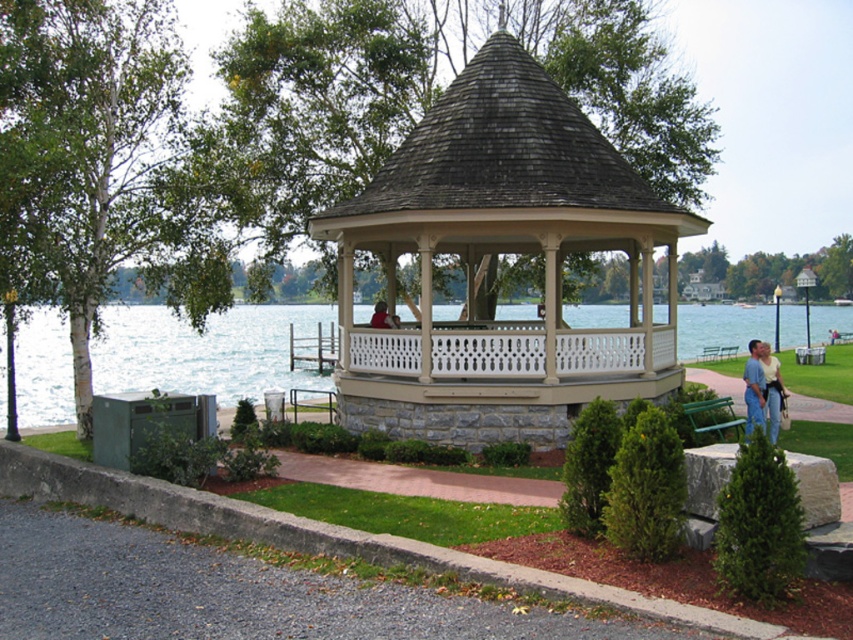
Question: Which is farther from the green wooden bench at center?

Choices:
 (A) red shirt at center
 (B) light blue jeans at lower right
 (C) clear blue water at lower left

Answer: (B)

Question: Based on their relative distances, which object is farther from the clear blue water at lower left?

Choices:
 (A) light blue jeans at lower right
 (B) beige wood gazebo at center

Answer: (A)

Question: Which point appears closest to the camera in this image?

Choices:
 (A) (756, 371)
 (B) (560, 397)

Answer: (A)

Question: Can you confirm if light blue jeans at lower right is positioned to the right of red shirt at center?

Choices:
 (A) yes
 (B) no

Answer: (A)

Question: Is beige wood gazebo at center to the right of red shirt at center from the viewer's perspective?

Choices:
 (A) yes
 (B) no

Answer: (A)

Question: Can you confirm if clear blue water at lower left is positioned to the left of green painted wood bench at lower right?

Choices:
 (A) yes
 (B) no

Answer: (B)